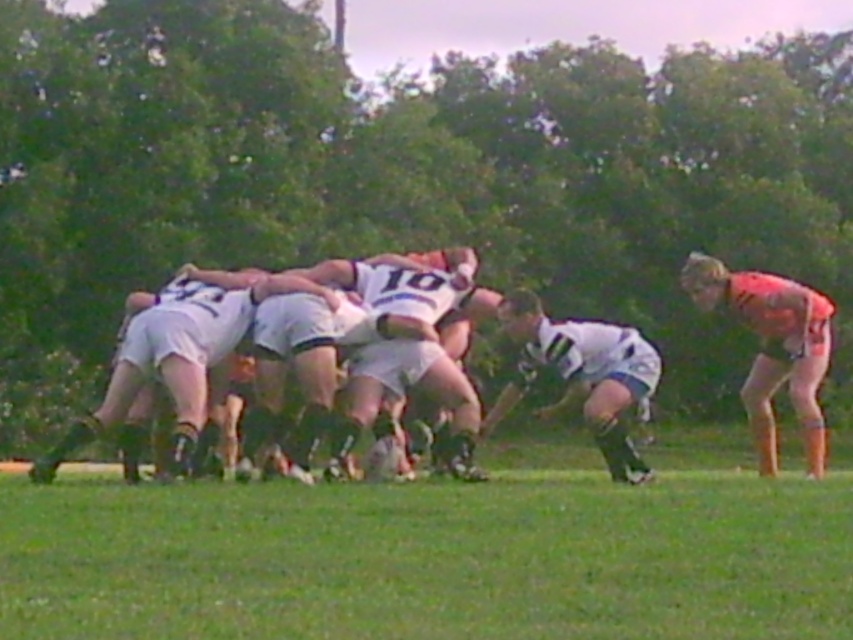
Question: Is green grass at center to the left of white matte jersey at center from the viewer's perspective?

Choices:
 (A) yes
 (B) no

Answer: (A)

Question: From the image, what is the correct spatial relationship of green grass at center in relation to white matte rugby ball at center?

Choices:
 (A) below
 (B) above

Answer: (A)

Question: Which of the following is the farthest from the observer?

Choices:
 (A) orange jersey at right
 (B) white matte jersey at center
 (C) green grass at center

Answer: (A)

Question: Which point appears farthest from the camera in this image?

Choices:
 (A) (84, 545)
 (B) (503, 394)
 (C) (120, 387)
 (D) (401, 296)

Answer: (B)

Question: Is green grass at center wider than white matte rugby ball at center?

Choices:
 (A) yes
 (B) no

Answer: (A)

Question: Considering the real-world distances, which object is closest to the white matte jersey at center?

Choices:
 (A) white matte shorts at center
 (B) white matte rugby ball at center
 (C) green grass at center

Answer: (B)